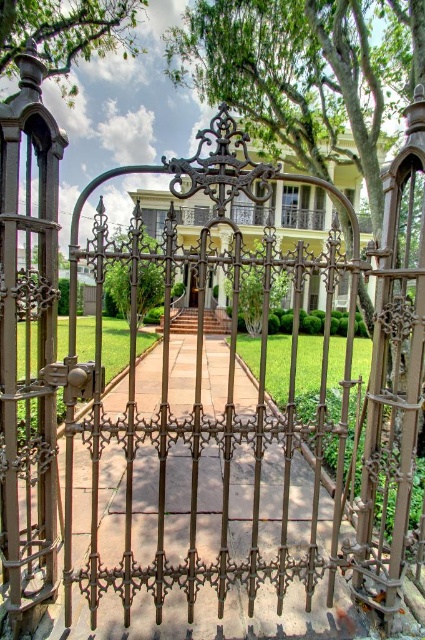
You are a delivery person arriving at the property and need to reach the matte bronze door at center. The green leafy tree at center is blocking your path. How can you navigate around it?

The green leafy tree at center is located above the matte bronze door at center, so the tree is positioned higher up and does not block the path to the door. You can proceed directly to the matte bronze door at center without needing to detour around the tree.

You are standing at the entrance of the stately house and want to walk towards the gate. Which point, point (155,241) or point (209,276), should you step on first to reach the gate?

You should step on point (155,241) first because it is in front of point (209,276), meaning it is closer to the entrance and the starting point.